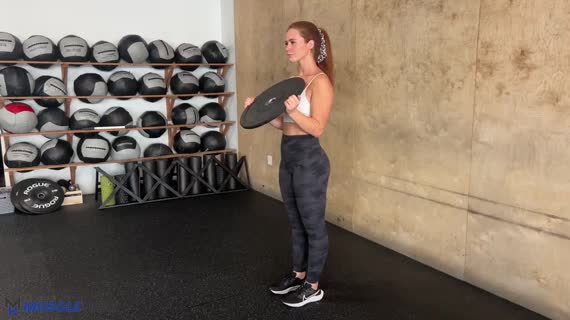
This screenshot has width=570, height=320. Find the location of `dark gym floor`. dark gym floor is located at coordinates (130, 251), (401, 286).